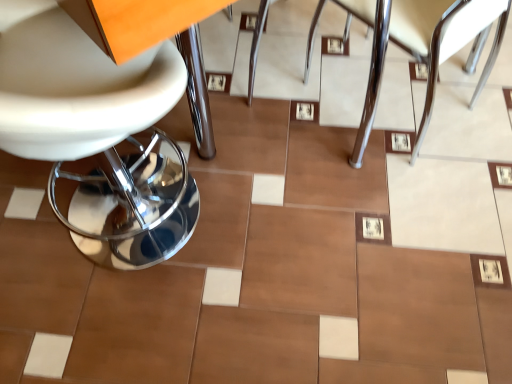
What is the approximate width of white leather chair at left, marked as the second chair in a right-to-left arrangement?

white leather chair at left, marked as the second chair in a right-to-left arrangement, is 19.52 inches in width.

Find the location of a particular element. The height and width of the screenshot is (384, 512). white leather chair at left, the 1th chair from the left is located at coordinates (97, 134).

This screenshot has height=384, width=512. What do you see at coordinates (97, 134) in the screenshot?
I see `white leather chair at left, marked as the second chair in a right-to-left arrangement` at bounding box center [97, 134].

Where is `satin chrome chair at center, which is the second chair in left-to-right order`? This screenshot has height=384, width=512. satin chrome chair at center, which is the second chair in left-to-right order is located at coordinates [x=423, y=45].

What do you see at coordinates (423, 45) in the screenshot?
I see `satin chrome chair at center, which is the second chair in left-to-right order` at bounding box center [423, 45].

From the picture: What is the approximate height of satin chrome chair at center, which is the second chair in left-to-right order?

The height of satin chrome chair at center, which is the second chair in left-to-right order, is 24.73 inches.

At what (x,y) coordinates should I click in order to perform the action: click on white leather chair at left, marked as the second chair in a right-to-left arrangement. Please return your answer as a coordinate pair (x, y). The image size is (512, 384). Looking at the image, I should click on (97, 134).

Based on the photo, does white leather chair at left, the 1th chair from the left, appear on the left side of satin chrome chair at center, which is the second chair in left-to-right order?

Indeed, white leather chair at left, the 1th chair from the left, is positioned on the left side of satin chrome chair at center, which is the second chair in left-to-right order.

Is white leather chair at left, marked as the second chair in a right-to-left arrangement, behind satin chrome chair at center, which is the second chair in left-to-right order?

No, white leather chair at left, marked as the second chair in a right-to-left arrangement, is closer to the viewer.

Is point (147, 74) closer to viewer compared to point (318, 17)?

That is True.

From the image's perspective, would you say white leather chair at left, marked as the second chair in a right-to-left arrangement, is shown under satin chrome chair at center, marked as the first chair in a right-to-left arrangement?

Yes, from the image's perspective, white leather chair at left, marked as the second chair in a right-to-left arrangement, is beneath satin chrome chair at center, marked as the first chair in a right-to-left arrangement.

From a real-world perspective, is white leather chair at left, the 1th chair from the left, located beneath satin chrome chair at center, marked as the first chair in a right-to-left arrangement?

No.

Does white leather chair at left, the 1th chair from the left, have a lesser width compared to satin chrome chair at center, marked as the first chair in a right-to-left arrangement?

Yes, white leather chair at left, the 1th chair from the left, is thinner than satin chrome chair at center, marked as the first chair in a right-to-left arrangement.

In terms of height, does white leather chair at left, marked as the second chair in a right-to-left arrangement, look taller or shorter compared to satin chrome chair at center, which is the second chair in left-to-right order?

In the image, white leather chair at left, marked as the second chair in a right-to-left arrangement, appears to be taller than satin chrome chair at center, which is the second chair in left-to-right order.

Considering the sizes of objects white leather chair at left, marked as the second chair in a right-to-left arrangement, and satin chrome chair at center, which is the second chair in left-to-right order, in the image provided, who is bigger, white leather chair at left, marked as the second chair in a right-to-left arrangement, or satin chrome chair at center, which is the second chair in left-to-right order,?

Bigger between the two is white leather chair at left, marked as the second chair in a right-to-left arrangement.

Is satin chrome chair at center, which is the second chair in left-to-right order, completely or partially inside white leather chair at left, marked as the second chair in a right-to-left arrangement?

No, white leather chair at left, marked as the second chair in a right-to-left arrangement, does not contain satin chrome chair at center, which is the second chair in left-to-right order.

From the picture: Are white leather chair at left, the 1th chair from the left, and satin chrome chair at center, marked as the first chair in a right-to-left arrangement, located far from each other?

They are positioned close to each other.

Does white leather chair at left, marked as the second chair in a right-to-left arrangement, turn towards satin chrome chair at center, which is the second chair in left-to-right order?

Yes, white leather chair at left, marked as the second chair in a right-to-left arrangement, is oriented towards satin chrome chair at center, which is the second chair in left-to-right order.

How many degrees apart are the facing directions of white leather chair at left, the 1th chair from the left, and satin chrome chair at center, which is the second chair in left-to-right order?

The angle between the facing direction of white leather chair at left, the 1th chair from the left, and the facing direction of satin chrome chair at center, which is the second chair in left-to-right order, is 92.9 degrees.

Could you measure the distance between white leather chair at left, marked as the second chair in a right-to-left arrangement, and satin chrome chair at center, which is the second chair in left-to-right order?

81.20 centimeters.

Identify the location of chair located underneath the white leather chair at left, marked as the second chair in a right-to-left arrangement (from a real-world perspective). The image size is (512, 384). (423, 45).

Considering the relative positions of satin chrome chair at center, marked as the first chair in a right-to-left arrangement, and white leather chair at left, the 1th chair from the left, in the image provided, is satin chrome chair at center, marked as the first chair in a right-to-left arrangement, to the left of white leather chair at left, the 1th chair from the left, from the viewer's perspective?

No.

Is satin chrome chair at center, which is the second chair in left-to-right order, closer to camera compared to white leather chair at left, marked as the second chair in a right-to-left arrangement?

No, satin chrome chair at center, which is the second chair in left-to-right order, is behind white leather chair at left, marked as the second chair in a right-to-left arrangement.

Is point (357, 11) closer to viewer compared to point (79, 30)?

No, it is not.

From the image's perspective, is satin chrome chair at center, which is the second chair in left-to-right order, positioned above or below white leather chair at left, marked as the second chair in a right-to-left arrangement?

Clearly, from the image's perspective, satin chrome chair at center, which is the second chair in left-to-right order, is above white leather chair at left, marked as the second chair in a right-to-left arrangement.

From a real-world perspective, is satin chrome chair at center, marked as the first chair in a right-to-left arrangement, located beneath white leather chair at left, the 1th chair from the left?

Correct, in the physical world, satin chrome chair at center, marked as the first chair in a right-to-left arrangement, is lower than white leather chair at left, the 1th chair from the left.

Which object is thinner, satin chrome chair at center, marked as the first chair in a right-to-left arrangement, or white leather chair at left, marked as the second chair in a right-to-left arrangement?

With smaller width is white leather chair at left, marked as the second chair in a right-to-left arrangement.

Looking at this image, between satin chrome chair at center, which is the second chair in left-to-right order, and white leather chair at left, the 1th chair from the left, which one has more height?

white leather chair at left, the 1th chair from the left.

Can you confirm if satin chrome chair at center, marked as the first chair in a right-to-left arrangement, is smaller than white leather chair at left, the 1th chair from the left?

Correct, satin chrome chair at center, marked as the first chair in a right-to-left arrangement, occupies less space than white leather chair at left, the 1th chair from the left.

Could white leather chair at left, the 1th chair from the left, be considered to be inside satin chrome chair at center, marked as the first chair in a right-to-left arrangement?

No.

Is there a large distance between satin chrome chair at center, marked as the first chair in a right-to-left arrangement, and white leather chair at left, the 1th chair from the left?

satin chrome chair at center, marked as the first chair in a right-to-left arrangement, is actually quite close to white leather chair at left, the 1th chair from the left.

Is satin chrome chair at center, marked as the first chair in a right-to-left arrangement, facing away from white leather chair at left, the 1th chair from the left?

That's not correct — satin chrome chair at center, marked as the first chair in a right-to-left arrangement, is not looking away from white leather chair at left, the 1th chair from the left.

What's the angular difference between satin chrome chair at center, marked as the first chair in a right-to-left arrangement, and white leather chair at left, the 1th chair from the left,'s facing directions?

The angular difference between satin chrome chair at center, marked as the first chair in a right-to-left arrangement, and white leather chair at left, the 1th chair from the left, is 92.9 degrees.

At what (x,y) coordinates should I click in order to perform the action: click on chair on the right of white leather chair at left, the 1th chair from the left. Please return your answer as a coordinate pair (x, y). The height and width of the screenshot is (384, 512). Looking at the image, I should click on (423, 45).

You are a GUI agent. You are given a task and a screenshot of the screen. Output one action in this format:
    pyautogui.click(x=<x>, y=<y>)
    Task: Click on the chair in front of the satin chrome chair at center, marked as the first chair in a right-to-left arrangement
    
    Given the screenshot: What is the action you would take?
    coord(97,134)

Find the location of `chair on the right of the white leather chair at left, marked as the second chair in a right-to-left arrangement`. chair on the right of the white leather chair at left, marked as the second chair in a right-to-left arrangement is located at coordinates (423, 45).